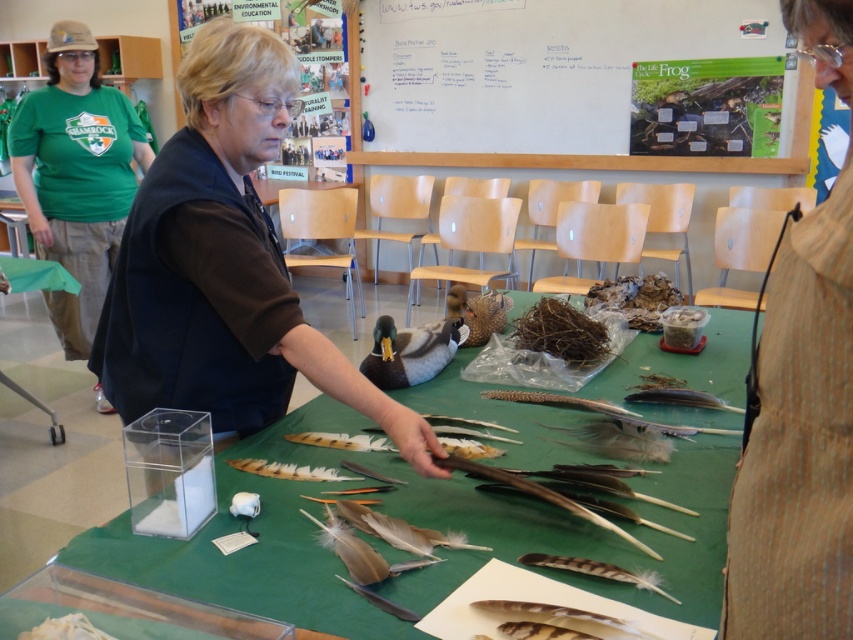
You are a student in a classroom and see the whiteboard at upper center and the matte brown duck at center. Which object is larger in size?

The whiteboard at upper center is bigger than the matte brown duck at center according to the description.

You are standing in front of the table with bird feathers and need to write down some notes. Where should you look to find the whiteboard at upper center?

The whiteboard at upper center is located at point coordinates (548,81).

You are a visitor at a bird exhibition and see the green fabric shirt at upper left and the white fluffy feathers at lower left. Which object is closer to you?

The green fabric shirt at upper left is closer to you because it is further to the viewer than the white fluffy feathers at lower left.